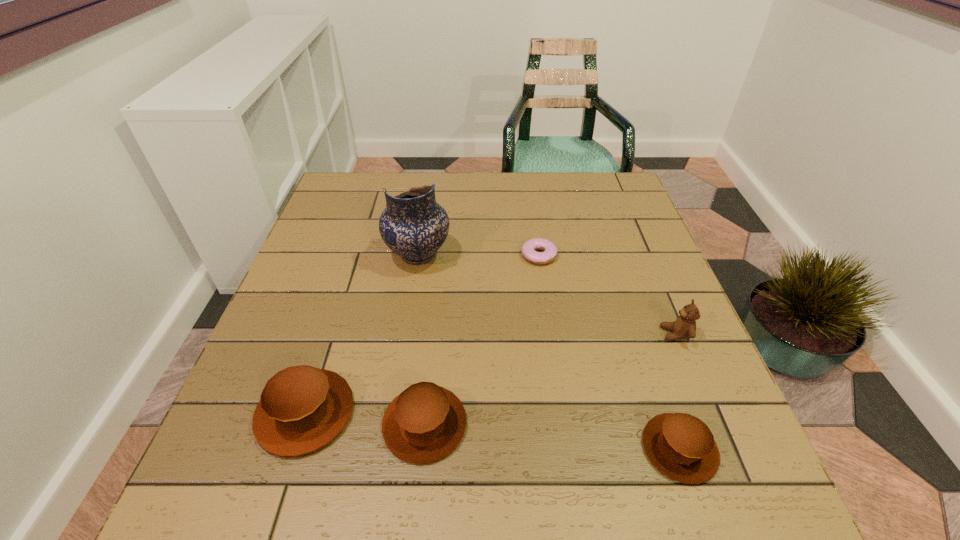
The width and height of the screenshot is (960, 540). In order to click on free space located 0.120m on the left of the shortest muffin in this screenshot , I will do `click(573, 448)`.

Where is `free space located 0.130m on the right of the tallest object`? free space located 0.130m on the right of the tallest object is located at coordinates (502, 255).

Locate an element on the screen. The height and width of the screenshot is (540, 960). free space located on the front of the doughnut is located at coordinates (554, 355).

In order to click on vacant space positioned 0.080m at the face of the teddy bear in this screenshot , I will do `click(624, 334)`.

Identify the location of vacant space located 0.130m at the face of the teddy bear. (600, 334).

Where is `vacant space located at the face of the teddy bear`? Image resolution: width=960 pixels, height=540 pixels. vacant space located at the face of the teddy bear is located at coordinates (535, 334).

Where is `object that is at the left edge`? object that is at the left edge is located at coordinates (302, 408).

This screenshot has width=960, height=540. Identify the location of muffin located in the right edge section of the desktop. coord(681,446).

Find the location of a particular element. The width and height of the screenshot is (960, 540). teddy bear that is at the right edge is located at coordinates (684, 327).

Where is `object situated at the near left corner`? Image resolution: width=960 pixels, height=540 pixels. object situated at the near left corner is located at coordinates (302, 408).